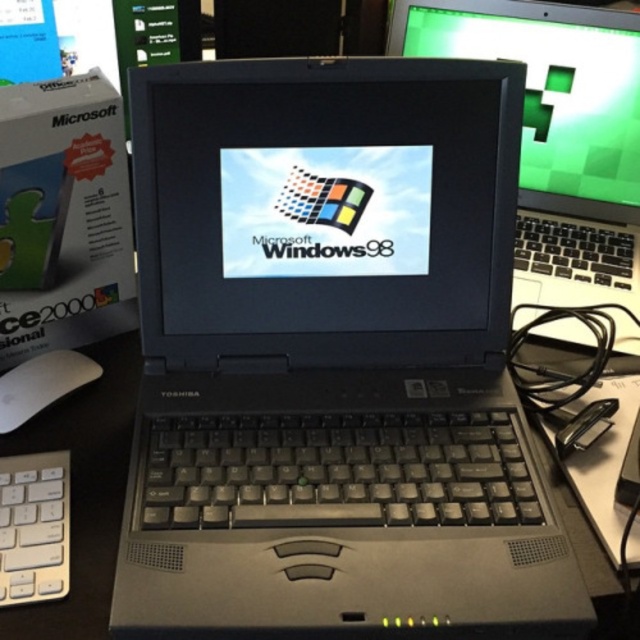
Who is more distant from viewer, (44, 520) or (38, 396)?

The point (38, 396) is more distant.

Who is lower down, white plastic keyboard at lower left or white matte mouse at lower left?

white plastic keyboard at lower left is lower down.

Does point (13, 500) come behind point (68, 364)?

No.

The height and width of the screenshot is (640, 640). Find the location of `white plastic keyboard at lower left`. white plastic keyboard at lower left is located at coordinates (33, 528).

From the picture: Is slate gray plastic laptop at center shorter than white matte mouse at lower left?

No.

Is slate gray plastic laptop at center taller than white matte mouse at lower left?

Yes.

Where is `slate gray plastic laptop at center`? slate gray plastic laptop at center is located at coordinates (332, 360).

In order to click on slate gray plastic laptop at center in this screenshot , I will do `click(332, 360)`.

Who is taller, black plastic table at center or white matte mouse at lower left?

black plastic table at center

Describe the element at coordinates (84, 490) in the screenshot. The image size is (640, 640). I see `black plastic table at center` at that location.

You are a GUI agent. You are given a task and a screenshot of the screen. Output one action in this format:
    pyautogui.click(x=<x>, y=<y>)
    Task: Click on the black plastic table at center
    The height and width of the screenshot is (640, 640).
    Given the screenshot: What is the action you would take?
    pyautogui.click(x=84, y=490)